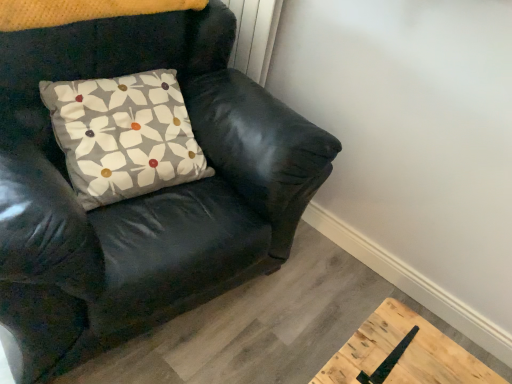
What do you see at coordinates (139, 197) in the screenshot?
I see `black leather chair at upper left` at bounding box center [139, 197].

Where is `black leather chair at upper left`? This screenshot has height=384, width=512. black leather chair at upper left is located at coordinates (139, 197).

In order to face black leather chair at upper left, should I rotate leftwards or rightwards?

Rotate your view left by about 17.152°.

Describe the element at coordinates (124, 135) in the screenshot. This screenshot has height=384, width=512. I see `floral-patterned fabric pillow at upper left` at that location.

Locate an element on the screen. The width and height of the screenshot is (512, 384). floral-patterned fabric pillow at upper left is located at coordinates (124, 135).

The image size is (512, 384). Identify the location of black leather chair at upper left. (139, 197).

Which object is positioned more to the left, floral-patterned fabric pillow at upper left or black leather chair at upper left?

Positioned to the left is black leather chair at upper left.

In the image, is floral-patterned fabric pillow at upper left positioned in front of or behind black leather chair at upper left?

In the image, floral-patterned fabric pillow at upper left appears behind black leather chair at upper left.

Considering the points (144, 118) and (32, 237), which point is in front, point (144, 118) or point (32, 237)?

Positioned in front is point (32, 237).

From the image's perspective, is floral-patterned fabric pillow at upper left beneath black leather chair at upper left?

No, from the image's perspective, floral-patterned fabric pillow at upper left is not beneath black leather chair at upper left.

From a real-world perspective, is floral-patterned fabric pillow at upper left on top of black leather chair at upper left?

Indeed, from a real-world perspective, floral-patterned fabric pillow at upper left stands above black leather chair at upper left.

In terms of width, does floral-patterned fabric pillow at upper left look wider or thinner when compared to black leather chair at upper left?

floral-patterned fabric pillow at upper left is thinner than black leather chair at upper left.

Considering the relative sizes of floral-patterned fabric pillow at upper left and black leather chair at upper left in the image provided, is floral-patterned fabric pillow at upper left shorter than black leather chair at upper left?

Yes.

From the picture: Based on their sizes in the image, would you say floral-patterned fabric pillow at upper left is bigger or smaller than black leather chair at upper left?

Clearly, floral-patterned fabric pillow at upper left is smaller in size than black leather chair at upper left.

Could black leather chair at upper left be considered to be inside floral-patterned fabric pillow at upper left?

Definitely not — black leather chair at upper left is not inside floral-patterned fabric pillow at upper left.

Are floral-patterned fabric pillow at upper left and black leather chair at upper left located far from each other?

No, floral-patterned fabric pillow at upper left is not far from black leather chair at upper left.

Could you tell me if floral-patterned fabric pillow at upper left is facing black leather chair at upper left?

Yes, floral-patterned fabric pillow at upper left is aimed at black leather chair at upper left.

How many degrees apart are the facing directions of floral-patterned fabric pillow at upper left and black leather chair at upper left?

The facing directions of floral-patterned fabric pillow at upper left and black leather chair at upper left are 3.29 degrees apart.

Could you measure the distance between floral-patterned fabric pillow at upper left and black leather chair at upper left?

floral-patterned fabric pillow at upper left is 6.32 inches away from black leather chair at upper left.

This screenshot has width=512, height=384. In order to click on chair below the floral-patterned fabric pillow at upper left (from a real-world perspective) in this screenshot , I will do `click(139, 197)`.

Is black leather chair at upper left to the right of floral-patterned fabric pillow at upper left from the viewer's perspective?

Incorrect, black leather chair at upper left is not on the right side of floral-patterned fabric pillow at upper left.

Is black leather chair at upper left positioned before floral-patterned fabric pillow at upper left?

Yes, black leather chair at upper left is closer to the viewer.

Which is behind, point (264, 107) or point (106, 192)?

The point (264, 107) is more distant.

From the image's perspective, between black leather chair at upper left and floral-patterned fabric pillow at upper left, which one is located above?

floral-patterned fabric pillow at upper left.

From a real-world perspective, does black leather chair at upper left stand above floral-patterned fabric pillow at upper left?

Incorrect, from a real-world perspective, black leather chair at upper left is lower than floral-patterned fabric pillow at upper left.

Considering the relative sizes of black leather chair at upper left and floral-patterned fabric pillow at upper left in the image provided, is black leather chair at upper left wider than floral-patterned fabric pillow at upper left?

Correct, the width of black leather chair at upper left exceeds that of floral-patterned fabric pillow at upper left.

Considering the sizes of objects black leather chair at upper left and floral-patterned fabric pillow at upper left in the image provided, who is shorter, black leather chair at upper left or floral-patterned fabric pillow at upper left?

floral-patterned fabric pillow at upper left is shorter.

Can you confirm if black leather chair at upper left is smaller than floral-patterned fabric pillow at upper left?

Actually, black leather chair at upper left might be larger than floral-patterned fabric pillow at upper left.

From the picture: Could floral-patterned fabric pillow at upper left be considered to be inside black leather chair at upper left?

Absolutely, floral-patterned fabric pillow at upper left is inside black leather chair at upper left.

In the scene shown: Is black leather chair at upper left not near floral-patterned fabric pillow at upper left?

No, black leather chair at upper left is not far from floral-patterned fabric pillow at upper left.

Is black leather chair at upper left oriented away from floral-patterned fabric pillow at upper left?

That's right, black leather chair at upper left is facing away from floral-patterned fabric pillow at upper left.

How many degrees apart are the facing directions of black leather chair at upper left and floral-patterned fabric pillow at upper left?

black leather chair at upper left and floral-patterned fabric pillow at upper left are facing 3.29 degrees away from each other.

This screenshot has height=384, width=512. In the image, there is a floral-patterned fabric pillow at upper left. Find the location of `chair below it (from a real-world perspective)`. chair below it (from a real-world perspective) is located at coordinates (139, 197).

The image size is (512, 384). What are the coordinates of `pillow behind the black leather chair at upper left` in the screenshot? It's located at (124, 135).

Find the location of `chair in front of the floral-patterned fabric pillow at upper left`. chair in front of the floral-patterned fabric pillow at upper left is located at coordinates [x=139, y=197].